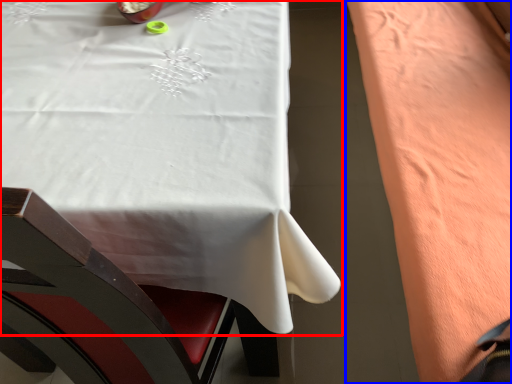
Question: Which point is further to the camera, table (highlighted by a red box) or blanket (highlighted by a blue box)?

Choices:
 (A) table
 (B) blanket

Answer: (B)